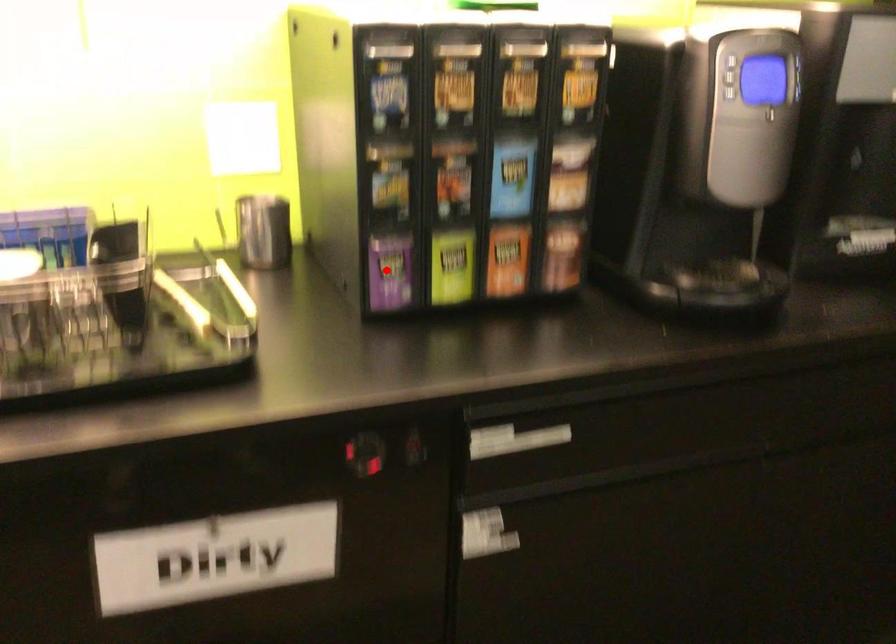
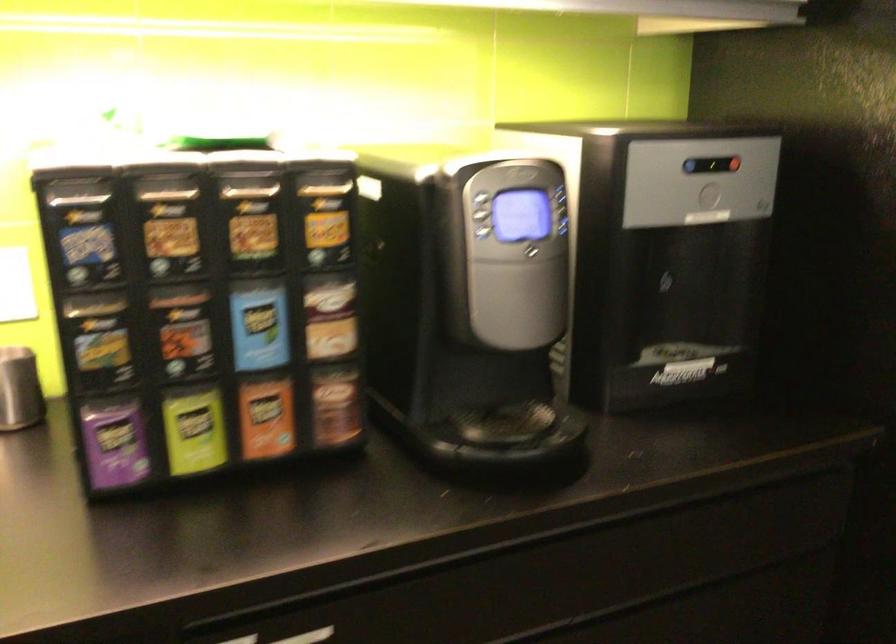
Where in the second image is the point corresponding to the highlighted location from the first image?

(114, 442)